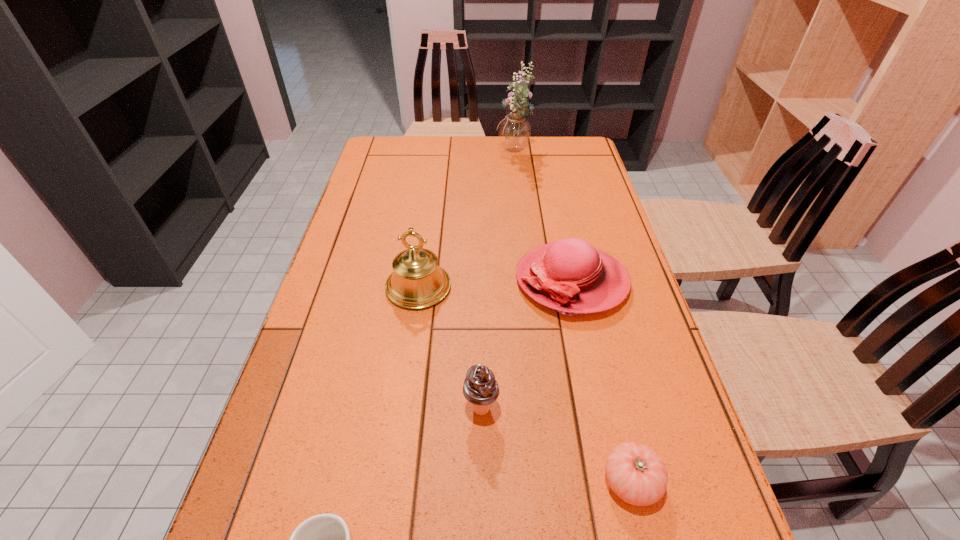
Identify the location of the farthest object. (514, 134).

Where is `the tallest object`? the tallest object is located at coordinates (514, 134).

Find the location of a particular element. bell is located at coordinates (417, 282).

Image resolution: width=960 pixels, height=540 pixels. What are the coordinates of `icecream` in the screenshot? It's located at (480, 388).

Image resolution: width=960 pixels, height=540 pixels. What are the coordinates of `the third nearest object` in the screenshot? It's located at (480, 388).

You are a GUI agent. You are given a task and a screenshot of the screen. Output one action in this format:
    pyautogui.click(x=<x>, y=<y>)
    Task: Click on the third shortest object
    This screenshot has height=540, width=960.
    Given the screenshot: What is the action you would take?
    pyautogui.click(x=570, y=276)

The image size is (960, 540). Identify the location of the fifth farthest object. (635, 472).

In order to click on vacant space situated 0.240m on the front-facing side of the bouquet in this screenshot , I will do `click(430, 155)`.

You are a GUI agent. You are given a task and a screenshot of the screen. Output one action in this format:
    pyautogui.click(x=<x>, y=<y>)
    Task: Click on the vacant space located 0.120m on the front-facing side of the bouquet
    
    Given the screenshot: What is the action you would take?
    pyautogui.click(x=463, y=155)

You are a GUI agent. You are given a task and a screenshot of the screen. Output one action in this format:
    pyautogui.click(x=<x>, y=<y>)
    Task: Click on the free space located 0.190m on the front-facing side of the bouquet
    
    Given the screenshot: What is the action you would take?
    pyautogui.click(x=444, y=155)